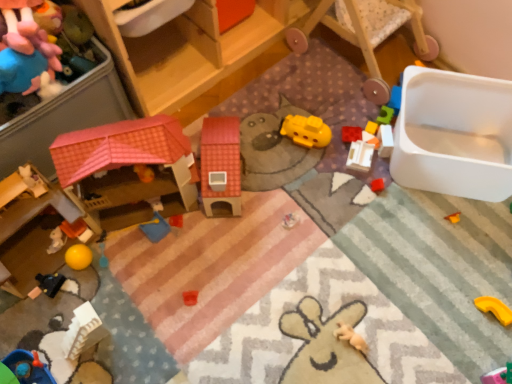
Where is `empty space that is in between light brown plush toy at lower right, the sixth toy from the right, and blue fabric toy at center, acting as the ninth toy starting from the right`? empty space that is in between light brown plush toy at lower right, the sixth toy from the right, and blue fabric toy at center, acting as the ninth toy starting from the right is located at coordinates (242, 279).